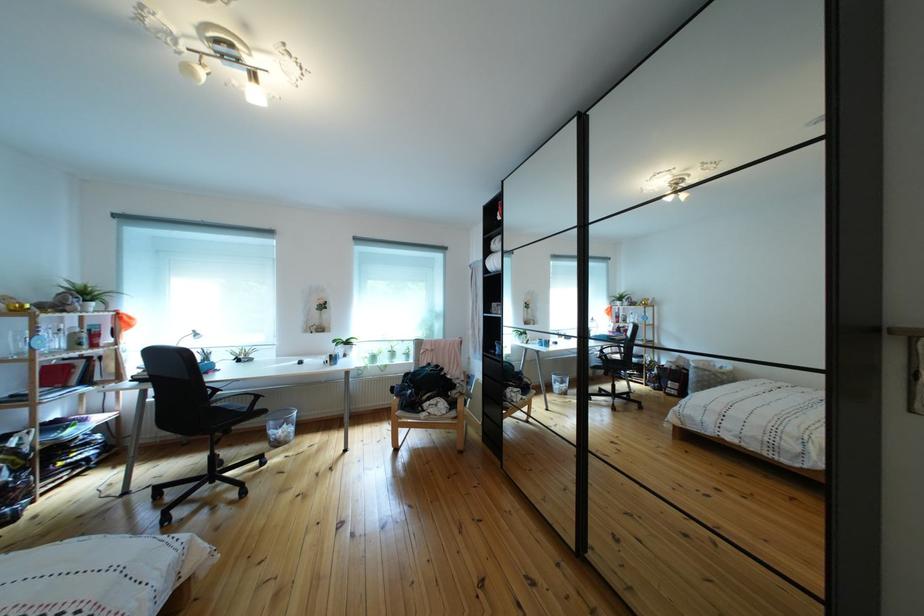
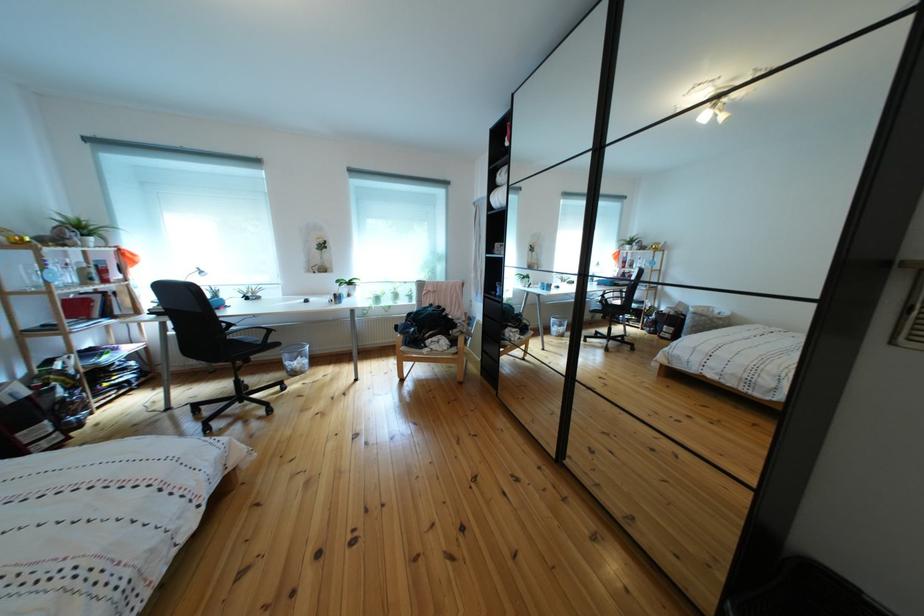
Where in the second image is the point corresponding to point 283,430 from the first image?

(297, 362)